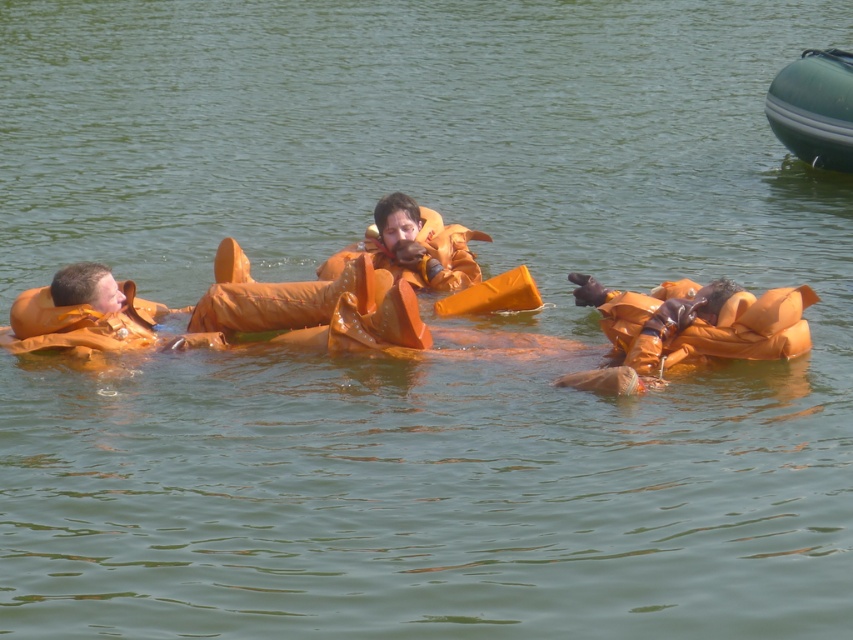
Between green rubber boat at upper right and orange matte life vest at lower right, which one is positioned lower?

orange matte life vest at lower right is below.

Between green rubber boat at upper right and orange matte life vest at lower right, which one appears on the right side from the viewer's perspective?

green rubber boat at upper right is more to the right.

This screenshot has height=640, width=853. Find the location of `green rubber boat at upper right`. green rubber boat at upper right is located at coordinates (814, 108).

Does orange matte life jacket at center have a greater width compared to green rubber boat at upper right?

Yes.

Which of these two, orange matte life jacket at center or green rubber boat at upper right, stands shorter?

orange matte life jacket at center is shorter.

Between point (741, 292) and point (796, 88), which one is positioned in front?

Positioned in front is point (741, 292).

Locate an element on the screen. This screenshot has width=853, height=640. orange matte life jacket at center is located at coordinates (706, 326).

What do you see at coordinates (706, 326) in the screenshot?
I see `orange matte life jacket at center` at bounding box center [706, 326].

Is orange matte life jacket at center closer to camera compared to orange rubber life vest at center?

Yes.

Find the location of `orange matte life jacket at center`. orange matte life jacket at center is located at coordinates (706, 326).